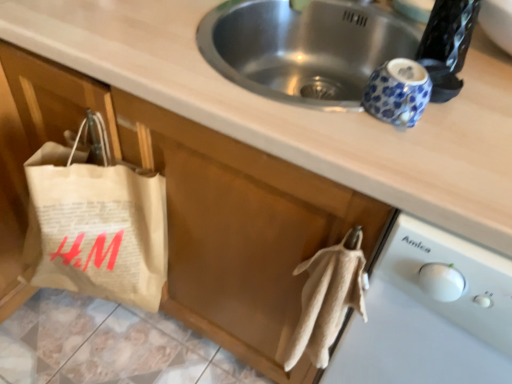
What are the coordinates of `natural paper bag at left` in the screenshot? It's located at (96, 225).

What do you see at coordinates (96, 225) in the screenshot?
I see `natural paper bag at left` at bounding box center [96, 225].

Describe the element at coordinates (429, 316) in the screenshot. I see `white plastic dishwasher at lower right` at that location.

The width and height of the screenshot is (512, 384). I want to click on white plastic dishwasher at lower right, so click(429, 316).

Locate an element on the screen. The width and height of the screenshot is (512, 384). natural paper bag at left is located at coordinates (96, 225).

Based on their positions, is white plastic dishwasher at lower right located to the left or right of natural paper bag at left?

Clearly, white plastic dishwasher at lower right is on the right of natural paper bag at left in the image.

Considering the positions of objects white plastic dishwasher at lower right and natural paper bag at left in the image provided, who is behind, white plastic dishwasher at lower right or natural paper bag at left?

natural paper bag at left.

Which is behind, point (406, 366) or point (78, 236)?

Point (78, 236)

From the image's perspective, between white plastic dishwasher at lower right and natural paper bag at left, which one is located above?

natural paper bag at left.

From a real-world perspective, is white plastic dishwasher at lower right located beneath natural paper bag at left?

Yes.

Which of these two, white plastic dishwasher at lower right or natural paper bag at left, is thinner?

natural paper bag at left is thinner.

Can you confirm if white plastic dishwasher at lower right is taller than natural paper bag at left?

Yes, white plastic dishwasher at lower right is taller than natural paper bag at left.

Between white plastic dishwasher at lower right and natural paper bag at left, which one has larger size?

With larger size is white plastic dishwasher at lower right.

Would you say white plastic dishwasher at lower right is inside or outside natural paper bag at left?

white plastic dishwasher at lower right is outside natural paper bag at left.

Does white plastic dishwasher at lower right touch natural paper bag at left?

white plastic dishwasher at lower right and natural paper bag at left are not in contact.

Could you tell me if white plastic dishwasher at lower right is facing natural paper bag at left?

No, white plastic dishwasher at lower right does not turn towards natural paper bag at left.

What's the angular difference between white plastic dishwasher at lower right and natural paper bag at left's facing directions?

The facing directions of white plastic dishwasher at lower right and natural paper bag at left are 3.27 degrees apart.

In the image, there is a natural paper bag at left. Identify the location of dish washer below it (from a real-world perspective). (429, 316).

Which is more to the left, natural paper bag at left or white plastic dishwasher at lower right?

From the viewer's perspective, natural paper bag at left appears more on the left side.

From the picture: Is natural paper bag at left positioned behind white plastic dishwasher at lower right?

Yes, the depth of natural paper bag at left is greater than that of white plastic dishwasher at lower right.

Considering the positions of point (85, 185) and point (426, 328), is point (85, 185) closer or farther from the camera than point (426, 328)?

Point (85, 185).

From the image's perspective, which is above, natural paper bag at left or white plastic dishwasher at lower right?

natural paper bag at left.

From a real-world perspective, between natural paper bag at left and white plastic dishwasher at lower right, who is vertically lower?

white plastic dishwasher at lower right.

Between natural paper bag at left and white plastic dishwasher at lower right, which one has larger width?

Wider between the two is white plastic dishwasher at lower right.

Considering the relative sizes of natural paper bag at left and white plastic dishwasher at lower right in the image provided, is natural paper bag at left taller than white plastic dishwasher at lower right?

Incorrect, the height of natural paper bag at left is not larger of that of white plastic dishwasher at lower right.

Considering the sizes of objects natural paper bag at left and white plastic dishwasher at lower right in the image provided, who is bigger, natural paper bag at left or white plastic dishwasher at lower right?

Bigger between the two is white plastic dishwasher at lower right.

Is natural paper bag at left inside or outside of white plastic dishwasher at lower right?

natural paper bag at left cannot be found inside white plastic dishwasher at lower right.

Is natural paper bag at left far away from white plastic dishwasher at lower right?

natural paper bag at left is near white plastic dishwasher at lower right, not far away.

Is natural paper bag at left aimed at white plastic dishwasher at lower right?

No, natural paper bag at left is not facing towards white plastic dishwasher at lower right.

Can you tell me how much natural paper bag at left and white plastic dishwasher at lower right differ in facing direction?

The facing directions of natural paper bag at left and white plastic dishwasher at lower right are 3.27 degrees apart.

The width and height of the screenshot is (512, 384). I want to click on dish washer in front of the natural paper bag at left, so click(x=429, y=316).

Find the location of a particular element. This screenshot has width=512, height=384. dish washer on the right of natural paper bag at left is located at coordinates (429, 316).

Where is `dish washer below the natural paper bag at left (from a real-world perspective)`? dish washer below the natural paper bag at left (from a real-world perspective) is located at coordinates (429, 316).